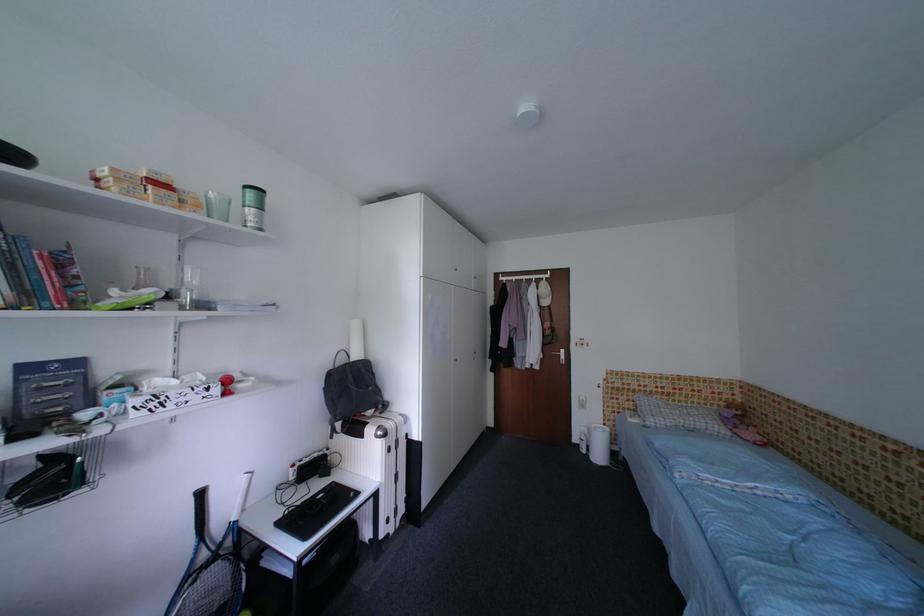
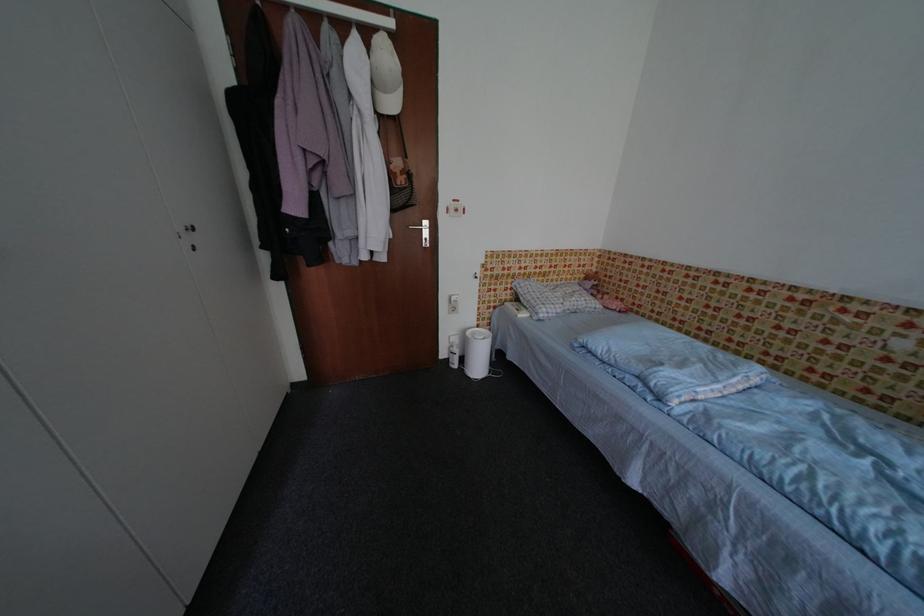
In the second image, find the point that corresponds to point (553, 305) in the first image.

(400, 107)